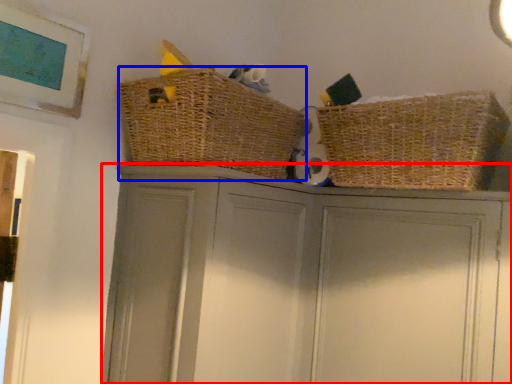
Question: Which of the following is the farthest to the observer, cupboard (highlighted by a red box) or basket (highlighted by a blue box)?

Choices:
 (A) cupboard
 (B) basket

Answer: (B)